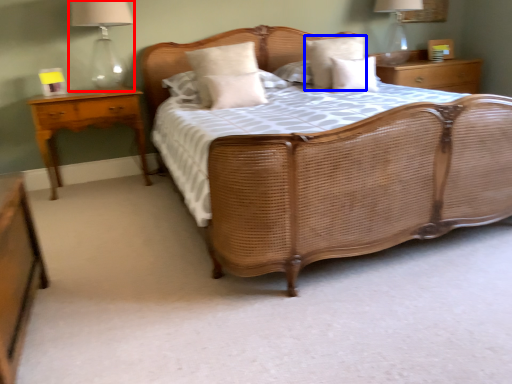
Question: Which object is closer to the camera taking this photo, bedside lamp (highlighted by a red box) or pillow (highlighted by a blue box)?

Choices:
 (A) bedside lamp
 (B) pillow

Answer: (A)